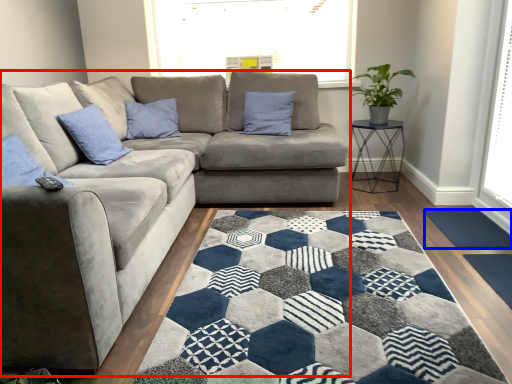
Question: Which point is further to the camera, studio couch (highlighted by a red box) or doormat (highlighted by a blue box)?

Choices:
 (A) studio couch
 (B) doormat

Answer: (B)